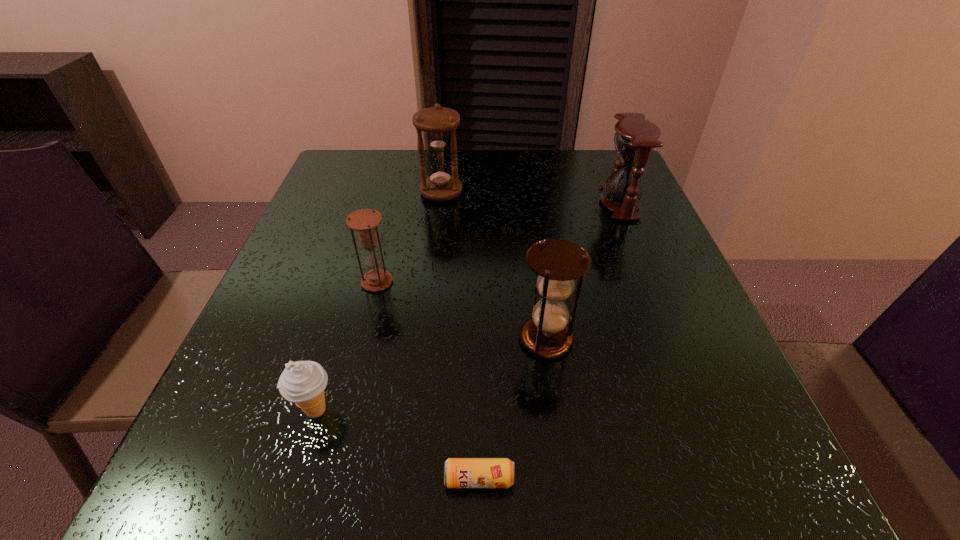
This screenshot has width=960, height=540. I want to click on hourglass identified as the third closest to the fourth farthest object, so click(439, 123).

Identify the location of free space that satisfies the following two spatial constraints: 1. on the front side of the rightmost object; 2. on the right side of the third hourglass from right to left. This screenshot has height=540, width=960. (440, 202).

The image size is (960, 540). I want to click on vacant space that satisfies the following two spatial constraints: 1. on the front side of the third hourglass from right to left; 2. on the right side of the second hourglass from right to left, so click(424, 339).

The height and width of the screenshot is (540, 960). What are the coordinates of `free space that satisfies the following two spatial constraints: 1. on the back side of the shortest hourglass; 2. on the left side of the rightmost object` in the screenshot? It's located at (396, 202).